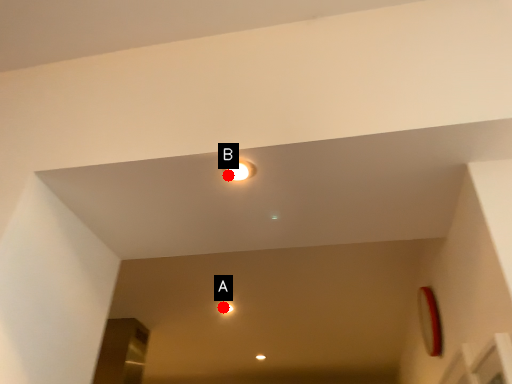
Question: Two points are circled on the image, labeled by A and B beside each circle. Which point is closer to the camera?

Choices:
 (A) A is closer
 (B) B is closer

Answer: (B)